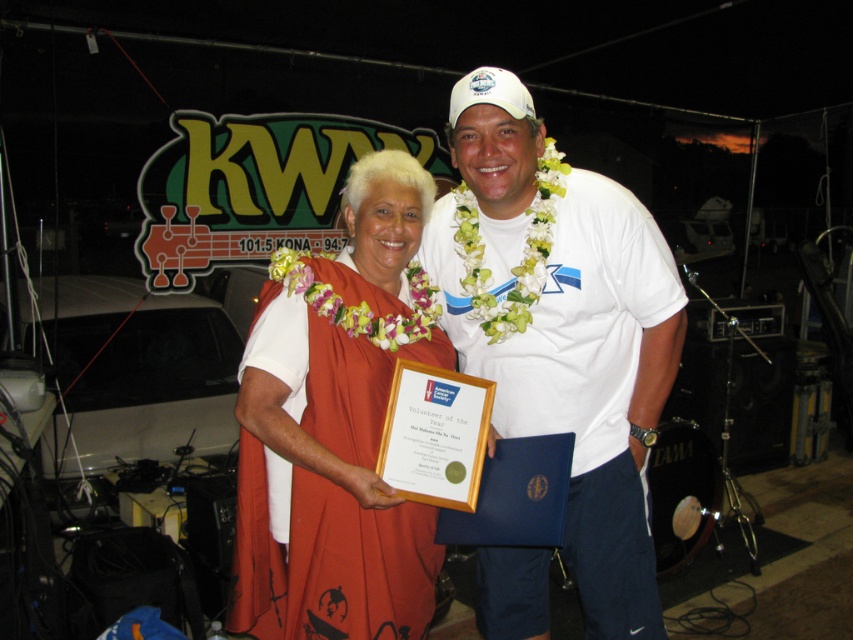
Who is more distant from viewer, (469, 342) or (234, 609)?

Positioned behind is point (469, 342).

Can you confirm if white t-shirt at center is smaller than orange fabric dress at center?

Actually, white t-shirt at center might be larger than orange fabric dress at center.

What are the coordinates of `white t-shirt at center` in the screenshot? It's located at (561, 328).